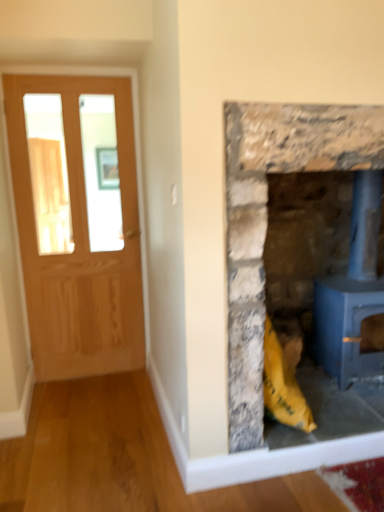
The height and width of the screenshot is (512, 384). Identify the location of vacant region under matte wooden door at left (from a real-world perspective). (107, 375).